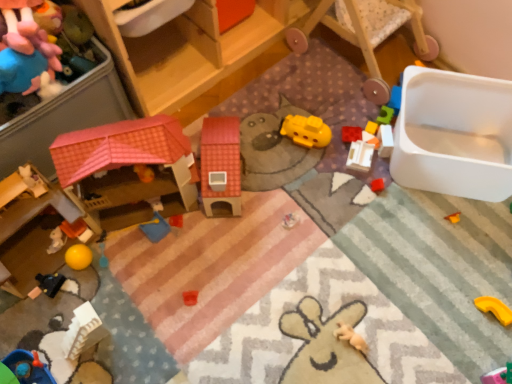
Image resolution: width=512 pixels, height=384 pixels. Find the location of `vacant area that lies between yellow rubber toy at lower right, which ranks as the 1th toy in right-to-left order, and blue fabric toy at center, arranged as the third toy when viewed from the left`. vacant area that lies between yellow rubber toy at lower right, which ranks as the 1th toy in right-to-left order, and blue fabric toy at center, arranged as the third toy when viewed from the left is located at coordinates (312, 270).